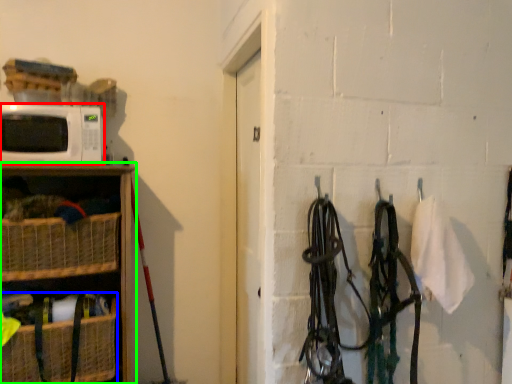
Question: Which is farther away from microwave oven (highlighted by a red box)? basket (highlighted by a blue box) or shelf (highlighted by a green box)?

Choices:
 (A) basket
 (B) shelf

Answer: (A)